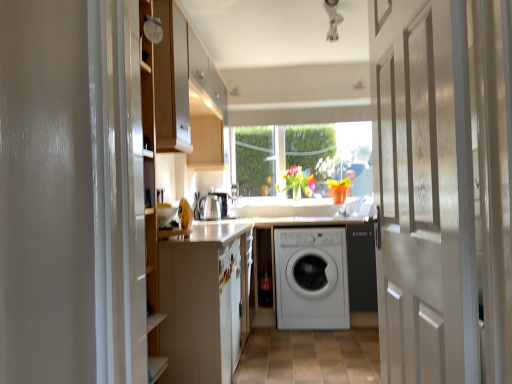
Question: Choose the correct answer: Is clear glass window at center inside white matte washing machine at center or outside it?

Choices:
 (A) outside
 (B) inside

Answer: (A)

Question: Is clear glass window at center in front of or behind white matte washing machine at center in the image?

Choices:
 (A) front
 (B) behind

Answer: (B)

Question: Estimate the real-world distances between objects in this image. Which object is farther from the white matte exhaust hood at center?

Choices:
 (A) vibrant glass vase at center
 (B) white matte cabinet at left
 (C) satin silver kettle at center
 (D) white matte washing machine at center
 (E) clear glass window at center

Answer: (B)

Question: Which object is the closest to the white glossy door at center?

Choices:
 (A) white matte washing machine at center
 (B) clear glass window at center
 (C) satin silver kettle at center
 (D) white matte exhaust hood at center
 (E) vibrant glass vase at center

Answer: (A)